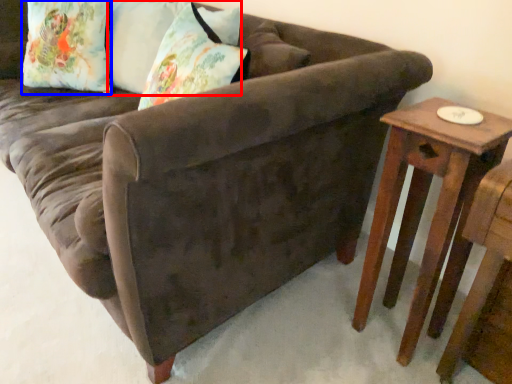
Question: Which point is further to the camera, pillow (highlighted by a red box) or pillow (highlighted by a blue box)?

Choices:
 (A) pillow
 (B) pillow

Answer: (B)